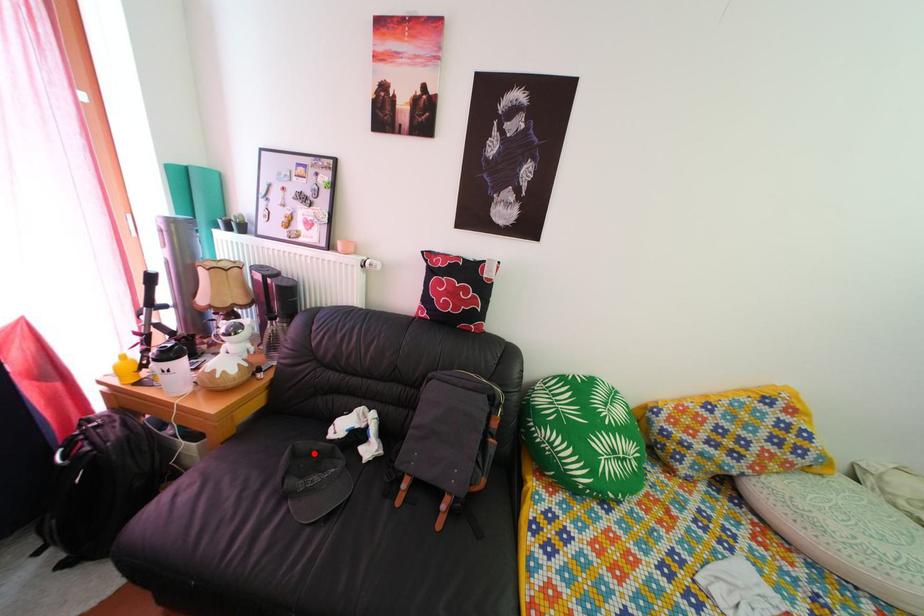
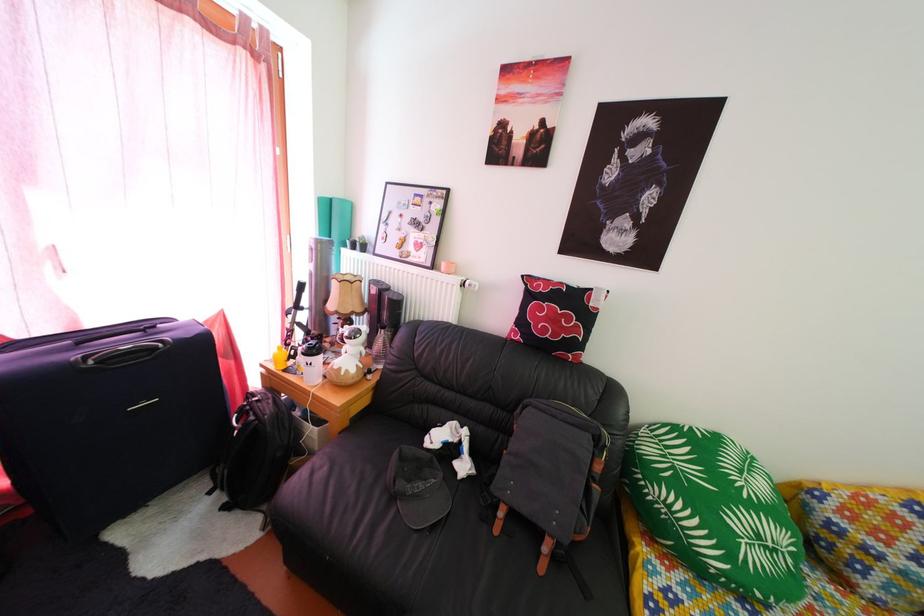
Locate, in the second image, the point that corresponds to the highlighted location in the first image.

(419, 458)